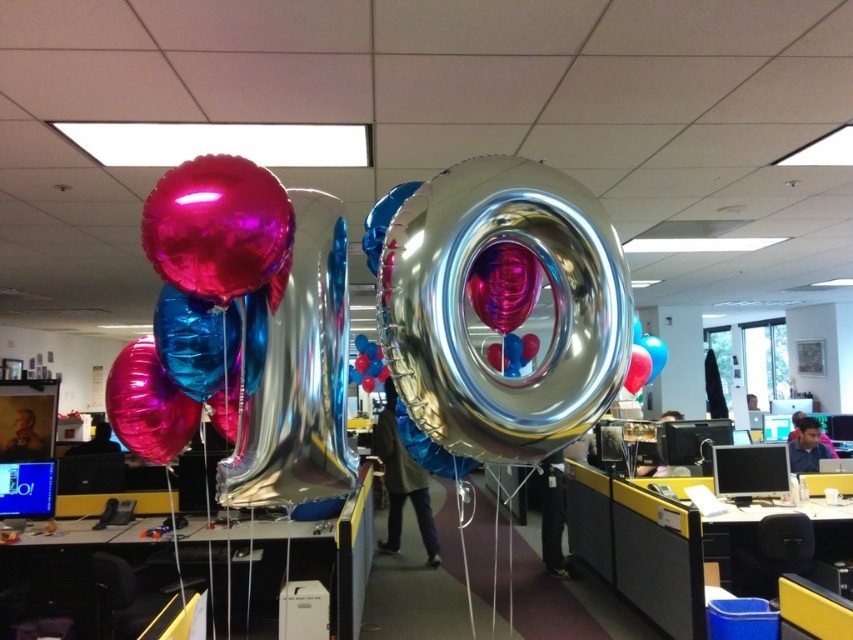
You are standing in the office and want to place a new decoration exactly at the same position as the shiny metallic balloon at center. What are the coordinates where you should place it?

The coordinates for the shiny metallic balloon at center are at point (498, 307).